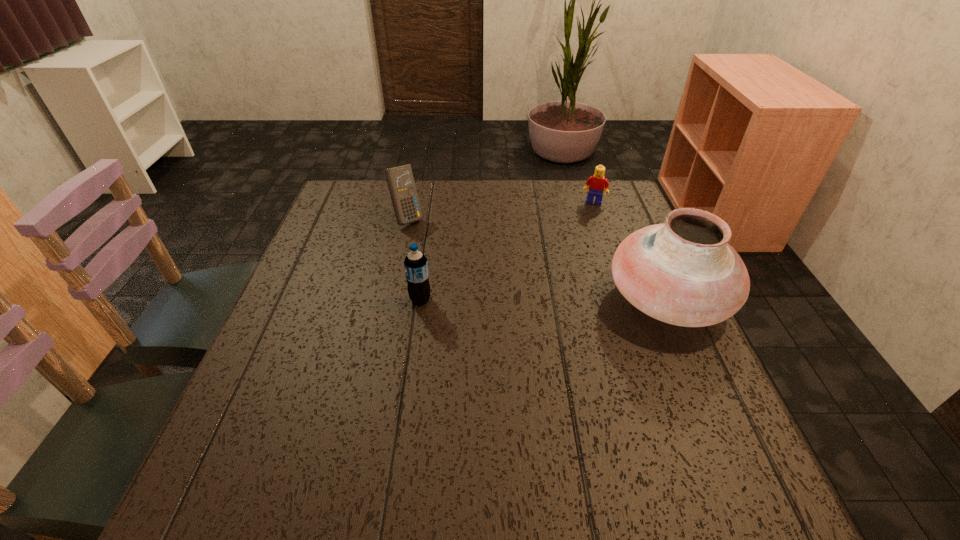
Image resolution: width=960 pixels, height=540 pixels. I want to click on free spot between the shortest object and the soda bottle, so click(507, 251).

This screenshot has width=960, height=540. I want to click on free area in between the second farthest object and the Lego, so click(500, 210).

You are a GUI agent. You are given a task and a screenshot of the screen. Output one action in this format:
    pyautogui.click(x=<x>, y=<y>)
    Task: Click on the object identified as the closest to the soda bottle
    The image size is (960, 540).
    Given the screenshot: What is the action you would take?
    pyautogui.click(x=400, y=180)

Identify which object is the third nearest to the shortest object. Please provide its 2D coordinates. Your answer should be formatted as a tuple, i.e. [(x, y)], where the tuple contains the x and y coordinates of a point satisfying the conditions above.

[(416, 265)]

In order to click on blank area in the image that satisfies the following two spatial constraints: 1. on the back side of the farthest object; 2. on the left side of the second farthest object in this screenshot , I will do `click(411, 202)`.

You are a GUI agent. You are given a task and a screenshot of the screen. Output one action in this format:
    pyautogui.click(x=<x>, y=<y>)
    Task: Click on the free point that satisfies the following two spatial constraints: 1. on the front side of the tallest object; 2. on the left side of the farthest object
    Image resolution: width=960 pixels, height=540 pixels.
    Given the screenshot: What is the action you would take?
    pyautogui.click(x=629, y=300)